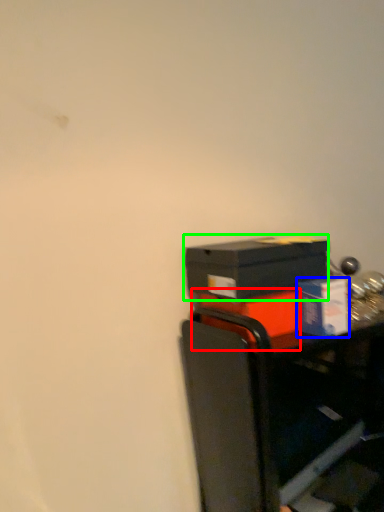
Question: Estimate the real-world distances between objects in this image. Which object is closer to box (highlighted by a red box), box (highlighted by a blue box) or box (highlighted by a green box)?

Choices:
 (A) box
 (B) box

Answer: (B)